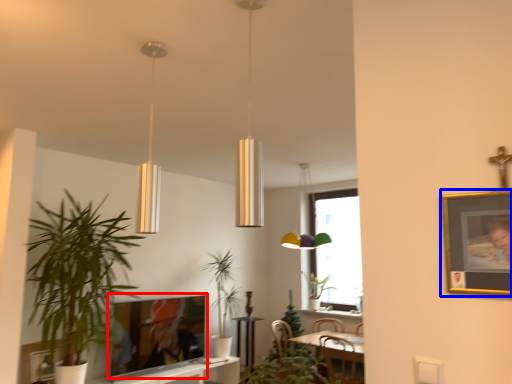
Question: Which object appears farthest to the camera in this image, picture frame (highlighted by a red box) or picture frame (highlighted by a blue box)?

Choices:
 (A) picture frame
 (B) picture frame

Answer: (A)